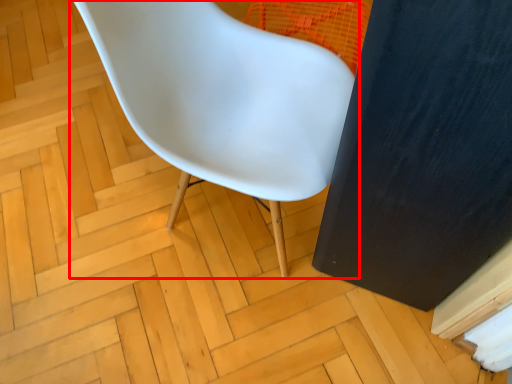
Question: In this image, where is chair (annotated by the red box) located relative to screen door?

Choices:
 (A) right
 (B) left

Answer: (B)